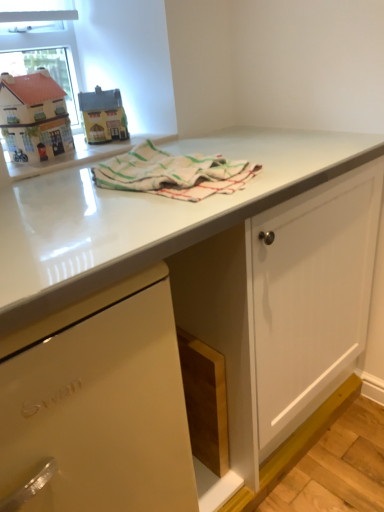
Question: Does matte plastic toy house at upper left appear on the left side of matte white dishwasher at lower left?

Choices:
 (A) yes
 (B) no

Answer: (B)

Question: Considering the relative sizes of matte plastic toy house at upper left and matte white dishwasher at lower left in the image provided, is matte plastic toy house at upper left bigger than matte white dishwasher at lower left?

Choices:
 (A) no
 (B) yes

Answer: (A)

Question: Does matte plastic toy house at upper left have a greater width compared to matte white dishwasher at lower left?

Choices:
 (A) no
 (B) yes

Answer: (A)

Question: From the image's perspective, is matte plastic toy house at upper left on matte white dishwasher at lower left?

Choices:
 (A) yes
 (B) no

Answer: (A)

Question: Does matte plastic toy house at upper left have a greater height compared to matte white dishwasher at lower left?

Choices:
 (A) yes
 (B) no

Answer: (B)

Question: From a real-world perspective, is clear glass window screen at upper left physically located above or below matte white dishwasher at lower left?

Choices:
 (A) below
 (B) above

Answer: (B)

Question: Is clear glass window screen at upper left wider or thinner than matte white dishwasher at lower left?

Choices:
 (A) wide
 (B) thin

Answer: (B)

Question: In the image, is clear glass window screen at upper left on the left side or the right side of matte white dishwasher at lower left?

Choices:
 (A) left
 (B) right

Answer: (A)

Question: Would you say clear glass window screen at upper left is inside or outside matte white dishwasher at lower left?

Choices:
 (A) outside
 (B) inside

Answer: (A)

Question: In terms of width, does matte white dishwasher at lower left look wider or thinner when compared to matte plastic toy house at upper left?

Choices:
 (A) wide
 (B) thin

Answer: (A)

Question: In terms of size, does matte white dishwasher at lower left appear bigger or smaller than matte plastic toy house at upper left?

Choices:
 (A) big
 (B) small

Answer: (A)

Question: Is matte white dishwasher at lower left inside or outside of matte plastic toy house at upper left?

Choices:
 (A) inside
 (B) outside

Answer: (B)

Question: Considering the positions of matte white dishwasher at lower left and matte plastic toy house at upper left in the image, is matte white dishwasher at lower left taller or shorter than matte plastic toy house at upper left?

Choices:
 (A) short
 (B) tall

Answer: (B)

Question: Is white striped cloth at center inside or outside of matte white dishwasher at lower left?

Choices:
 (A) inside
 (B) outside

Answer: (B)

Question: From the image's perspective, is white striped cloth at center positioned above or below matte white dishwasher at lower left?

Choices:
 (A) above
 (B) below

Answer: (A)